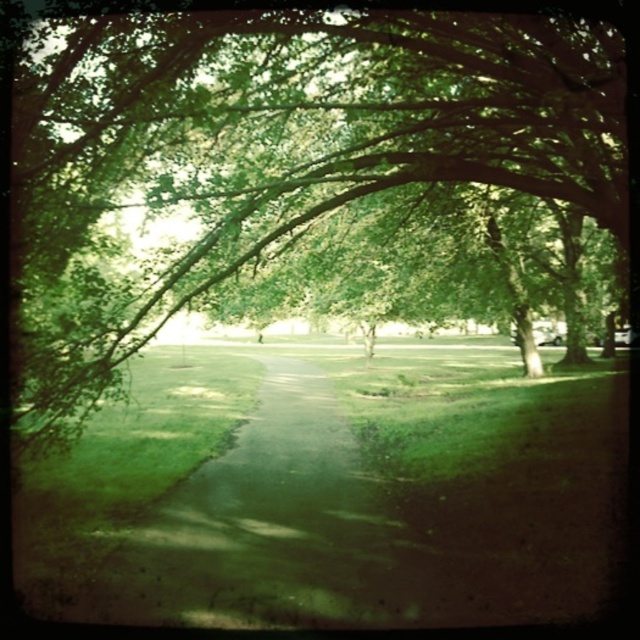
Question: Which of the following is the farthest from the observer?

Choices:
 (A) green grassy path at center
 (B) green leafy tree at center

Answer: (B)

Question: Does green leafy tree at center appear under green grassy path at center?

Choices:
 (A) yes
 (B) no

Answer: (B)

Question: Is the position of green leafy tree at center less distant than that of green grassy path at center?

Choices:
 (A) yes
 (B) no

Answer: (B)

Question: In this image, where is green leafy tree at center located relative to green grassy path at center?

Choices:
 (A) below
 (B) above

Answer: (B)